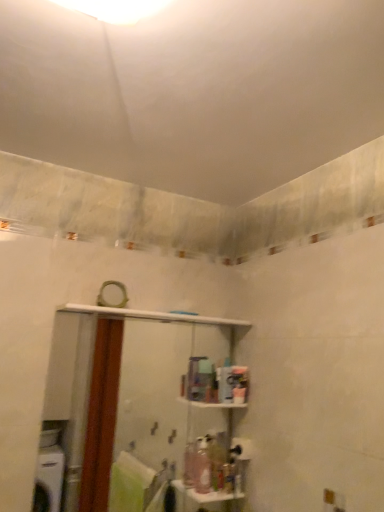
Question: Does pink plastic bottle at center, the second toiletry from the right, have a greater height compared to white glossy shelf at center?

Choices:
 (A) no
 (B) yes

Answer: (A)

Question: Could white glossy shelf at center be considered to be inside pink plastic bottle at center, arranged as the 1th toiletry when viewed from the left?

Choices:
 (A) no
 (B) yes

Answer: (A)

Question: From the image's perspective, is pink plastic bottle at center, the second toiletry from the right, beneath white glossy shelf at center?

Choices:
 (A) yes
 (B) no

Answer: (A)

Question: Is pink plastic bottle at center, the second toiletry from the right, thinner than white glossy shelf at center?

Choices:
 (A) yes
 (B) no

Answer: (B)

Question: Is pink plastic bottle at center, arranged as the 1th toiletry when viewed from the left, outside white glossy shelf at center?

Choices:
 (A) no
 (B) yes

Answer: (B)

Question: Does pink plastic bottle at center, the second toiletry from the right, have a greater width compared to white glossy shelf at center?

Choices:
 (A) no
 (B) yes

Answer: (B)

Question: Considering the relative positions of translucent plastic soap dispenser at lower center, the first toiletry in the right-to-left sequence, and matte white mirror at upper center in the image provided, is translucent plastic soap dispenser at lower center, the first toiletry in the right-to-left sequence, to the left of matte white mirror at upper center from the viewer's perspective?

Choices:
 (A) yes
 (B) no

Answer: (B)

Question: Would you say matte white mirror at upper center is part of translucent plastic soap dispenser at lower center, marked as the second toiletry in a left-to-right arrangement,'s contents?

Choices:
 (A) yes
 (B) no

Answer: (B)

Question: Is the surface of translucent plastic soap dispenser at lower center, marked as the second toiletry in a left-to-right arrangement, in direct contact with matte white mirror at upper center?

Choices:
 (A) no
 (B) yes

Answer: (A)

Question: Is translucent plastic soap dispenser at lower center, marked as the second toiletry in a left-to-right arrangement, not inside matte white mirror at upper center?

Choices:
 (A) yes
 (B) no

Answer: (A)

Question: Does translucent plastic soap dispenser at lower center, marked as the second toiletry in a left-to-right arrangement, have a smaller size compared to matte white mirror at upper center?

Choices:
 (A) yes
 (B) no

Answer: (A)

Question: Is translucent plastic soap dispenser at lower center, marked as the second toiletry in a left-to-right arrangement, facing towards matte white mirror at upper center?

Choices:
 (A) yes
 (B) no

Answer: (B)

Question: Considering the relative positions of pink plastic bottle at center, arranged as the 1th toiletry when viewed from the left, and translucent plastic soap dispenser at lower center, marked as the second toiletry in a left-to-right arrangement, in the image provided, is pink plastic bottle at center, arranged as the 1th toiletry when viewed from the left, behind translucent plastic soap dispenser at lower center, marked as the second toiletry in a left-to-right arrangement,?

Choices:
 (A) yes
 (B) no

Answer: (B)